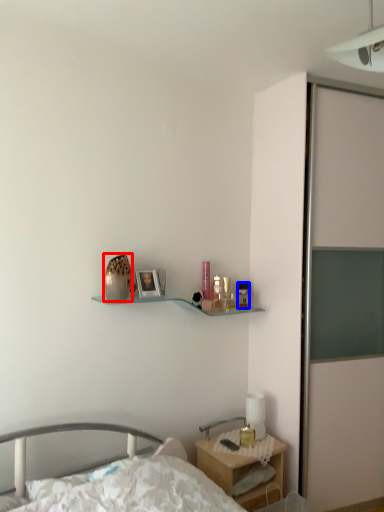
Question: Which of the following is the farthest to the observer, vase (highlighted by a red box) or toiletry (highlighted by a blue box)?

Choices:
 (A) vase
 (B) toiletry

Answer: (B)